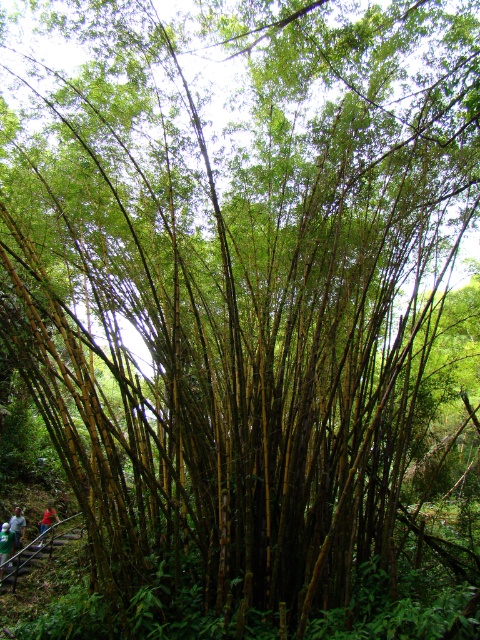
Question: Which point is farther to the camera?

Choices:
 (A) (24, 534)
 (B) (45, 522)
 (C) (4, 525)

Answer: (B)

Question: Among these objects, which one is farthest from the camera?

Choices:
 (A) green fabric person at lower left
 (B) green fabric shirt at lower left
 (C) red fabric person at lower left

Answer: (C)

Question: Is green fabric person at lower left wider than red fabric person at lower left?

Choices:
 (A) yes
 (B) no

Answer: (B)

Question: Considering the relative positions of green fabric person at lower left and red fabric person at lower left in the image provided, where is green fabric person at lower left located with respect to red fabric person at lower left?

Choices:
 (A) above
 (B) below

Answer: (B)

Question: Which object is closer to the camera taking this photo?

Choices:
 (A) red fabric person at lower left
 (B) green fabric person at lower left
 (C) green fabric shirt at lower left

Answer: (B)

Question: Does green fabric person at lower left appear under green fabric shirt at lower left?

Choices:
 (A) no
 (B) yes

Answer: (B)